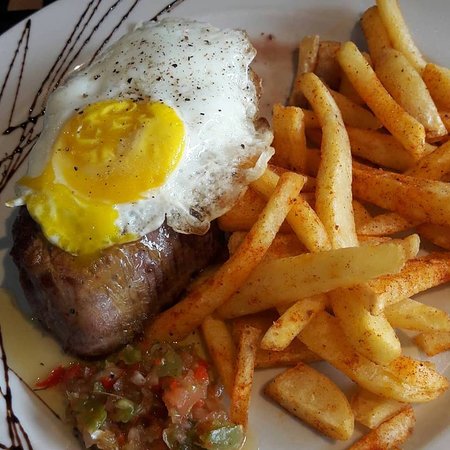
Identify the location of plate. This screenshot has height=450, width=450. (46, 428), (279, 431).